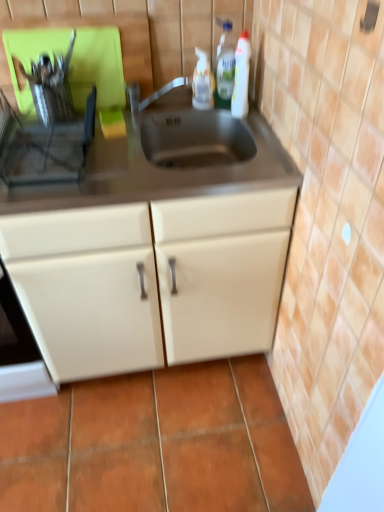
Question: From the image's perspective, is white plastic bottle at upper right, which ranks as the 1th bottle in right-to-left order, located above or below satin nickel faucet at center?

Choices:
 (A) above
 (B) below

Answer: (A)

Question: Looking at their shapes, would you say white plastic bottle at upper right, the third bottle viewed from the left, is wider or thinner than satin nickel faucet at center?

Choices:
 (A) thin
 (B) wide

Answer: (B)

Question: Estimate the real-world distances between objects in this image. Which object is closer to the translucent plastic spray bottle at upper center, the 3th bottle from the right?

Choices:
 (A) translucent plastic bottle at upper right, marked as the 2th bottle in a left-to-right arrangement
 (B) white plastic bottle at upper right, the third bottle viewed from the left
 (C) metallic silver dish rack at left
 (D) satin nickel faucet at center
 (E) matte cream cabinet at center

Answer: (A)

Question: Estimate the real-world distances between objects in this image. Which object is farther from the matte cream cabinet at center?

Choices:
 (A) white plastic bottle at upper right, which ranks as the 1th bottle in right-to-left order
 (B) metallic silver dish rack at left
 (C) satin nickel faucet at center
 (D) translucent plastic bottle at upper right, marked as the 2th bottle in a left-to-right arrangement
 (E) translucent plastic spray bottle at upper center, the 3th bottle from the right

Answer: (E)